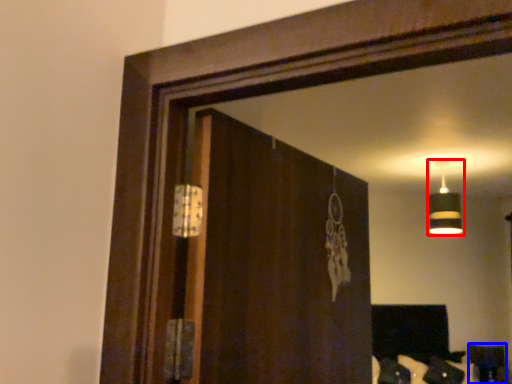
Question: Which object appears closest to the camera in this image, lamp (highlighted by a red box) or furniture (highlighted by a blue box)?

Choices:
 (A) lamp
 (B) furniture

Answer: (A)